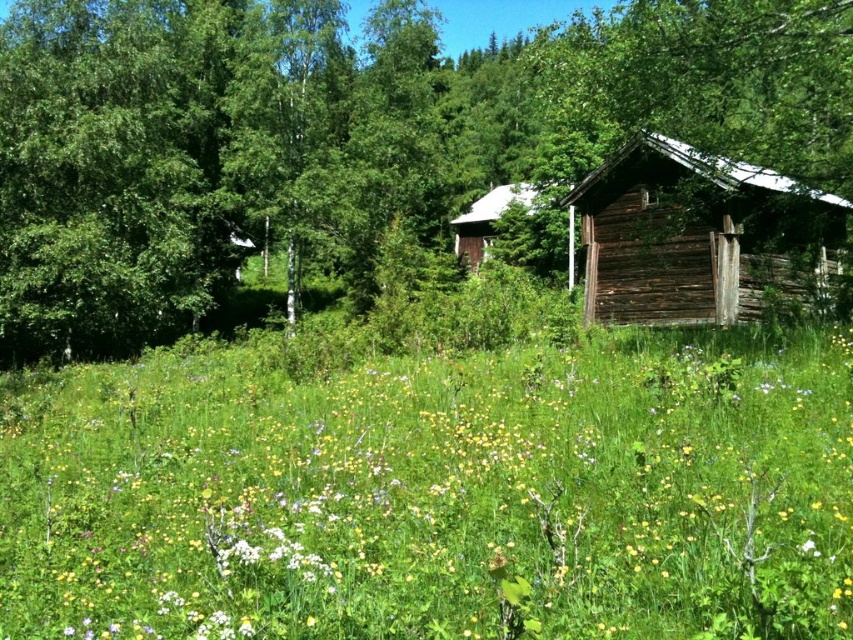
Question: Does yellow matte flower at center have a larger size compared to green wood tree at center?

Choices:
 (A) no
 (B) yes

Answer: (A)

Question: Among these objects, which one is nearest to the camera?

Choices:
 (A) yellow matte flower at center
 (B) green wood tree at center

Answer: (A)

Question: In this image, where is yellow matte flower at center located relative to weathered wood cabin at right?

Choices:
 (A) right
 (B) left

Answer: (B)

Question: Estimate the real-world distances between objects in this image. Which object is farther from the wooden cabin at center?

Choices:
 (A) green wood tree at center
 (B) yellow matte flower at center
 (C) weathered wood cabin at right

Answer: (B)

Question: Observing the image, what is the correct spatial positioning of green wood tree at center in reference to weathered wood cabin at right?

Choices:
 (A) above
 (B) below

Answer: (A)

Question: Which of these objects is positioned farthest from the green wood tree at center?

Choices:
 (A) weathered wood cabin at right
 (B) wooden cabin at center

Answer: (A)